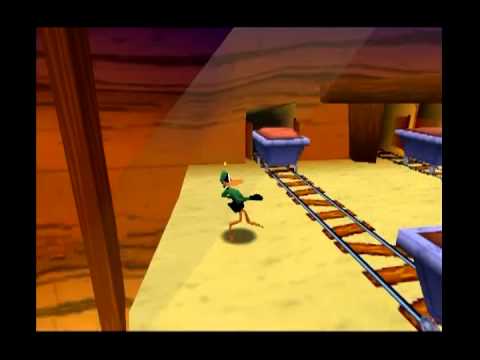
You are a GUI agent. You are given a task and a screenshot of the screen. Output one action in this format:
    pyautogui.click(x=<x>, y=<y>)
    Task: Click on the yellow floor
    
    Given the screenshot: What is the action you would take?
    pyautogui.click(x=285, y=303)